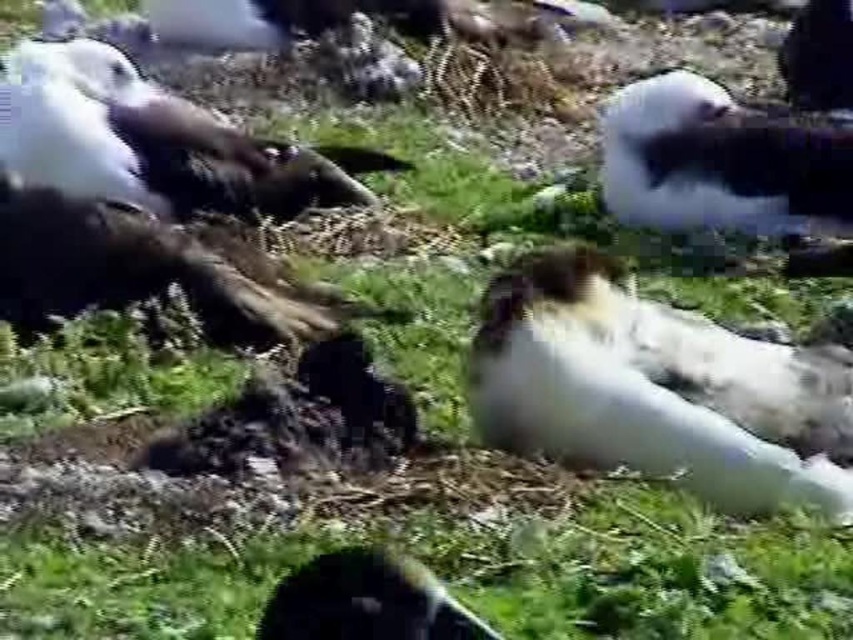
Who is positioned more to the left, white fluffy bird at center or white fluffy mollymawk at lower center?

Positioned to the left is white fluffy mollymawk at lower center.

Is white fluffy bird at center to the right of white fluffy mollymawk at lower center from the viewer's perspective?

Correct, you'll find white fluffy bird at center to the right of white fluffy mollymawk at lower center.

Identify the location of white fluffy bird at center. The image size is (853, 640). (656, 388).

Which of these two, white fluffy bird at upper left or white fluffy bird at upper right, stands shorter?

Standing shorter between the two is white fluffy bird at upper left.

Does white fluffy bird at upper left come behind white fluffy bird at upper right?

That is False.

Does point (175, 205) lie behind point (708, 180)?

No, (175, 205) is in front of (708, 180).

You are a GUI agent. You are given a task and a screenshot of the screen. Output one action in this format:
    pyautogui.click(x=<x>, y=<y>)
    Task: Click on the white fluffy bird at upper left
    The height and width of the screenshot is (640, 853).
    Given the screenshot: What is the action you would take?
    pyautogui.click(x=154, y=141)

Between white fluffy bird at upper right and white fluffy mollymawk at lower center, which one is positioned higher?

white fluffy bird at upper right

The image size is (853, 640). I want to click on white fluffy bird at upper right, so click(721, 161).

Identify the location of white fluffy bird at upper right. (721, 161).